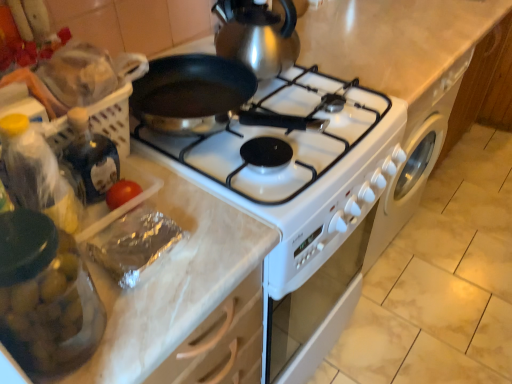
This screenshot has width=512, height=384. Identify the location of vacant space to the right of translucent plastic bottle at left. (198, 240).